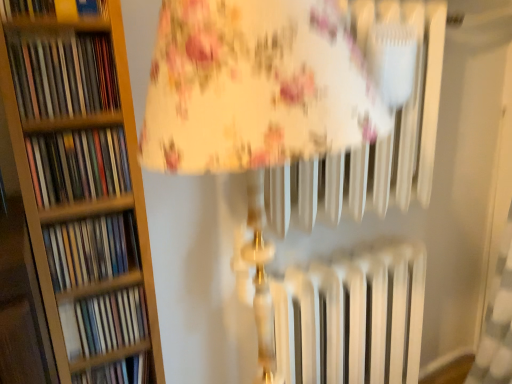
Question: Does matte plastic book at left, the fifth book in the top-to-bottom sequence, have a smaller size compared to matte plastic books at left, the second book positioned from the top?

Choices:
 (A) yes
 (B) no

Answer: (A)

Question: Can you confirm if matte plastic book at left, the fifth book in the top-to-bottom sequence, is positioned to the left of matte plastic books at left, the second book positioned from the top?

Choices:
 (A) yes
 (B) no

Answer: (B)

Question: From the image's perspective, is matte plastic book at left, the 2th book positioned from the bottom, on top of matte plastic books at left, the second book positioned from the top?

Choices:
 (A) yes
 (B) no

Answer: (B)

Question: Is matte plastic book at left, the fifth book in the top-to-bottom sequence, to the right of matte plastic books at left, which is counted as the 5th book, starting from the bottom, from the viewer's perspective?

Choices:
 (A) no
 (B) yes

Answer: (B)

Question: Does matte plastic book at left, the fifth book in the top-to-bottom sequence, have a lesser height compared to matte plastic books at left, which is counted as the 5th book, starting from the bottom?

Choices:
 (A) no
 (B) yes

Answer: (B)

Question: Based on their sizes in the image, would you say matte plastic book at left, the fifth book in the top-to-bottom sequence, is bigger or smaller than multicolored paperbacks at left, the third book in the top-to-bottom sequence?

Choices:
 (A) big
 (B) small

Answer: (A)

Question: From a real-world perspective, relative to multicolored paperbacks at left, the 4th book positioned from the bottom, is matte plastic book at left, the 2th book positioned from the bottom, vertically above or below?

Choices:
 (A) below
 (B) above

Answer: (A)

Question: Considering the positions of matte plastic book at left, the fifth book in the top-to-bottom sequence, and multicolored paperbacks at left, the 4th book positioned from the bottom, in the image, is matte plastic book at left, the fifth book in the top-to-bottom sequence, wider or thinner than multicolored paperbacks at left, the 4th book positioned from the bottom,?

Choices:
 (A) wide
 (B) thin

Answer: (A)

Question: Relative to multicolored paperbacks at left, the 4th book positioned from the bottom, is matte plastic book at left, the fifth book in the top-to-bottom sequence, in front or behind?

Choices:
 (A) front
 (B) behind

Answer: (B)

Question: Looking at their shapes, would you say matte plastic books at left, the second book positioned from the top, is wider or thinner than hardcover book at upper left, the 6th book when ordered from bottom to top?

Choices:
 (A) wide
 (B) thin

Answer: (B)

Question: From a real-world perspective, is matte plastic books at left, the second book positioned from the top, positioned above or below hardcover book at upper left, the 6th book when ordered from bottom to top?

Choices:
 (A) above
 (B) below

Answer: (B)

Question: Is matte plastic books at left, the second book positioned from the top, taller or shorter than hardcover book at upper left, the first book from the top?

Choices:
 (A) tall
 (B) short

Answer: (B)

Question: Is matte plastic books at left, which is counted as the 5th book, starting from the bottom, spatially inside hardcover book at upper left, the 6th book when ordered from bottom to top, or outside of it?

Choices:
 (A) inside
 (B) outside

Answer: (B)

Question: In the image, is hardcover book at upper left, the first book from the top, on the left side or the right side of matte plastic book at left, the 2th book positioned from the bottom?

Choices:
 (A) left
 (B) right

Answer: (A)

Question: From the image's perspective, relative to matte plastic book at left, the 2th book positioned from the bottom, is hardcover book at upper left, the first book from the top, above or below?

Choices:
 (A) below
 (B) above

Answer: (B)